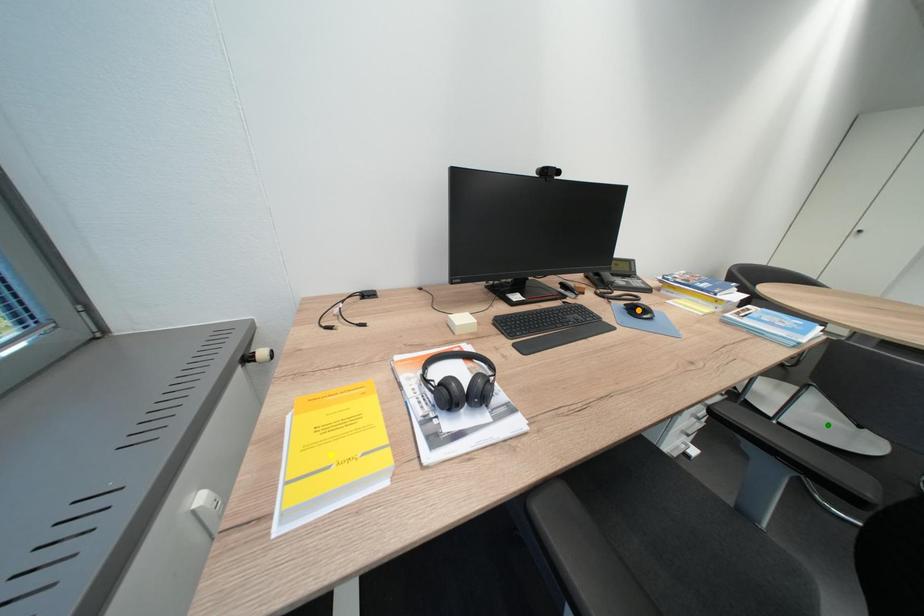
Order these from nearest to farthest:
green point
orange point
yellow point

yellow point, orange point, green point